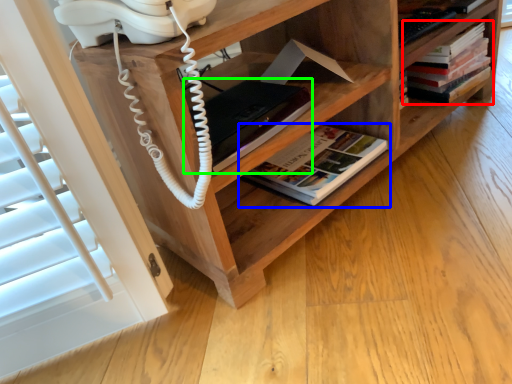
Question: Based on their relative distances, which object is farther from book (highlighted by a red box)? Choose from book (highlighted by a blue box) and paperback book (highlighted by a green box).

Choices:
 (A) book
 (B) paperback book

Answer: (B)